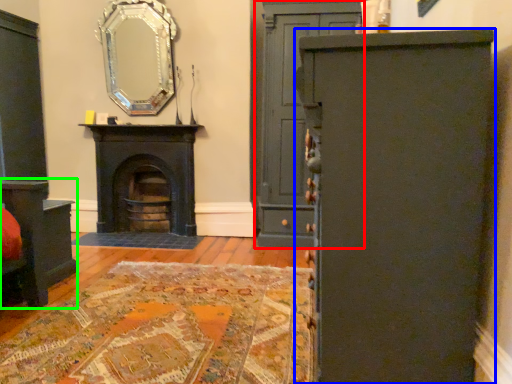
Question: Considering the real-world distances, which object is farthest from door (highlighted by a red box)? cabinetry (highlighted by a blue box) or vanity (highlighted by a green box)?

Choices:
 (A) cabinetry
 (B) vanity

Answer: (A)